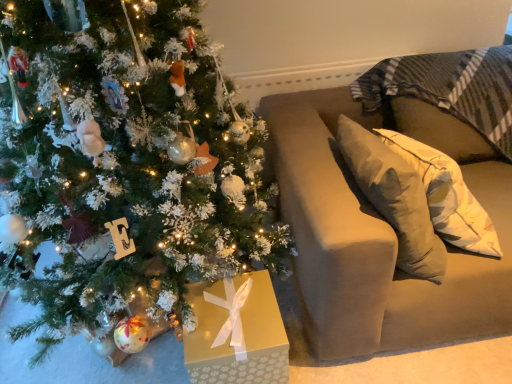
Question: Is velvet beige sofa at right surrounding white frosted christmas tree at left?

Choices:
 (A) yes
 (B) no

Answer: (B)

Question: Is velvet beige sofa at right completely or partially outside of white frosted christmas tree at left?

Choices:
 (A) no
 (B) yes

Answer: (B)

Question: Does velvet beige sofa at right lie in front of white frosted christmas tree at left?

Choices:
 (A) yes
 (B) no

Answer: (B)

Question: Considering the relative positions of velvet beige sofa at right and white frosted christmas tree at left in the image provided, is velvet beige sofa at right to the left of white frosted christmas tree at left from the viewer's perspective?

Choices:
 (A) no
 (B) yes

Answer: (A)

Question: From a real-world perspective, does velvet beige sofa at right stand above white frosted christmas tree at left?

Choices:
 (A) no
 (B) yes

Answer: (A)

Question: Does velvet beige sofa at right have a smaller size compared to white frosted christmas tree at left?

Choices:
 (A) yes
 (B) no

Answer: (A)

Question: From a real-world perspective, is white frosted christmas tree at left positioned under velvet beige sofa at right based on gravity?

Choices:
 (A) no
 (B) yes

Answer: (A)

Question: Can you confirm if white frosted christmas tree at left is taller than velvet beige sofa at right?

Choices:
 (A) no
 (B) yes

Answer: (B)

Question: Does white frosted christmas tree at left come in front of velvet beige sofa at right?

Choices:
 (A) yes
 (B) no

Answer: (A)

Question: Is white frosted christmas tree at left wider than velvet beige sofa at right?

Choices:
 (A) yes
 (B) no

Answer: (A)

Question: From a real-world perspective, is white frosted christmas tree at left physically above velvet beige sofa at right?

Choices:
 (A) yes
 (B) no

Answer: (A)

Question: Can you confirm if white frosted christmas tree at left is positioned to the left of velvet beige sofa at right?

Choices:
 (A) no
 (B) yes

Answer: (B)

Question: Considering the positions of velvet beige sofa at right and white frosted christmas tree at left in the image, is velvet beige sofa at right wider or thinner than white frosted christmas tree at left?

Choices:
 (A) wide
 (B) thin

Answer: (B)